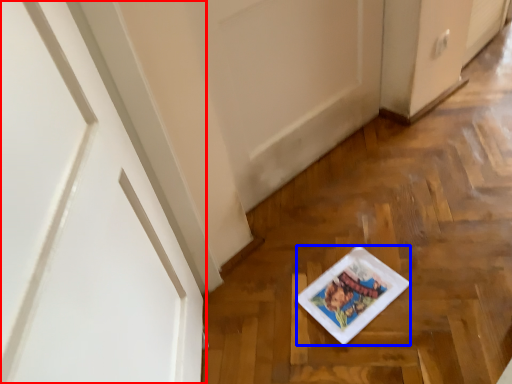
Question: Which object is further to the camera taking this photo, door (highlighted by a red box) or platter (highlighted by a blue box)?

Choices:
 (A) door
 (B) platter

Answer: (B)